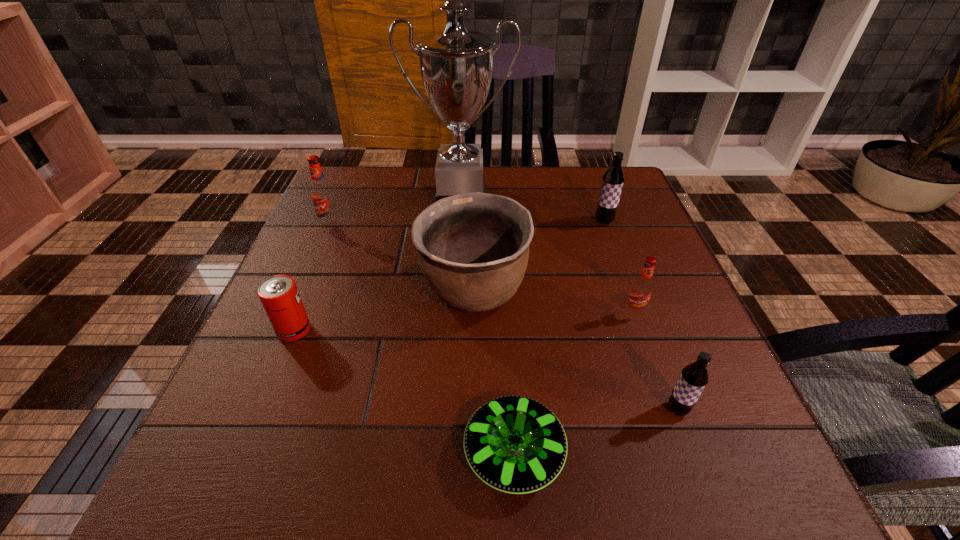
The width and height of the screenshot is (960, 540). Find the location of `saucer`. saucer is located at coordinates (514, 444).

This screenshot has width=960, height=540. What are the coordinates of `the shortest object` in the screenshot? It's located at (514, 444).

Where is `free point located at the front view of the trophy cup`? free point located at the front view of the trophy cup is located at coordinates (452, 331).

The height and width of the screenshot is (540, 960). Identify the location of vacant space located on the front of the farther brown root beer. (617, 259).

Where is `blank space located 0.240m on the front of the bigger red root beer`? This screenshot has height=540, width=960. blank space located 0.240m on the front of the bigger red root beer is located at coordinates (298, 302).

You are a GUI agent. You are given a task and a screenshot of the screen. Output one action in this format:
    pyautogui.click(x=<x>, y=<y>)
    Task: Click on the free point located on the left of the pottery
    This screenshot has height=540, width=960.
    Given the screenshot: What is the action you would take?
    pyautogui.click(x=277, y=291)

The image size is (960, 540). Identify the location of free location located 0.080m on the right of the nearer red root beer. (684, 312).

I want to click on free spot located on the back of the nearer brown root beer, so click(651, 338).

You are a GUI agent. You are given a task and a screenshot of the screen. Output one action in this format:
    pyautogui.click(x=<x>, y=<y>)
    Task: Click on the vacant space located 0.250m on the front of the second shortest object
    
    Given the screenshot: What is the action you would take?
    pyautogui.click(x=231, y=482)

The height and width of the screenshot is (540, 960). What are the coordinates of `free location located on the back of the saucer` in the screenshot? It's located at (504, 292).